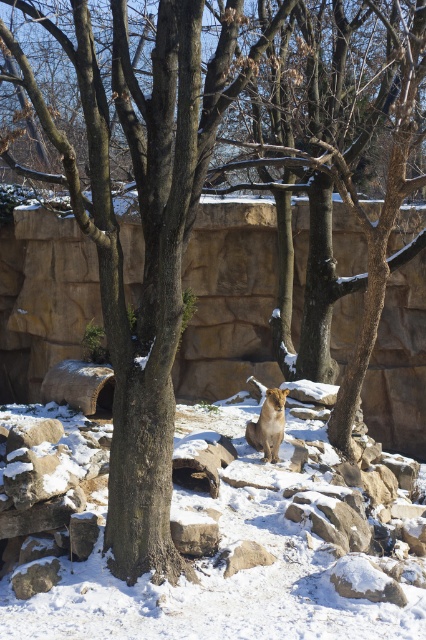
Question: Does gray rough rock at lower right have a smaller size compared to golden fur lion at center?

Choices:
 (A) yes
 (B) no

Answer: (A)

Question: Where is white powdery snow at center located in relation to gray rough stone at lower center in the image?

Choices:
 (A) above
 (B) below

Answer: (B)

Question: Which object is positioned farthest from the brown rough stone at lower center?

Choices:
 (A) golden fur lion at center
 (B) white powdery snow at center

Answer: (A)

Question: Among these points, which one is nearest to the camera?

Choices:
 (A) (245, 557)
 (B) (273, 401)

Answer: (A)

Question: Can you confirm if gray rough stone at lower center is positioned below brown rough stone at lower center?

Choices:
 (A) no
 (B) yes

Answer: (A)

Question: Which object is positioned farthest from the gray rough rock at lower right?

Choices:
 (A) brown rough stone at lower center
 (B) white powdery snow at center
 (C) gray rough stone at lower center

Answer: (B)